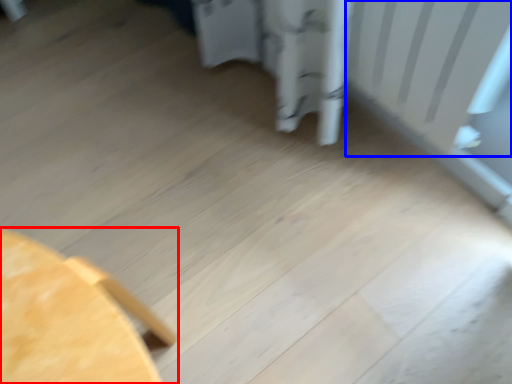
Question: Which point is closer to the camera, furniture (highlighted by a red box) or radiator (highlighted by a blue box)?

Choices:
 (A) furniture
 (B) radiator

Answer: (A)